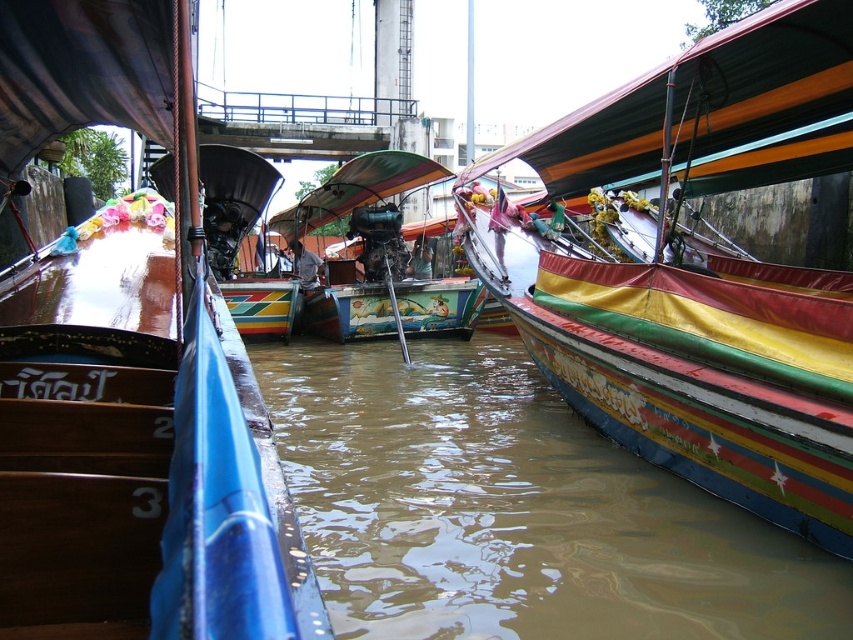
You are a tourist standing on the wooden boat at left. You want to see the brown murky water at center. Which direction should you look?

You should look downward because the brown murky water at center is located below the wooden boat at left.

You are standing on the wooden boat at left and want to move to the multicolored painted boat at center. Which direction should you go to reach it?

The multicolored painted boat at center is located below the wooden boat at left, so you should go downward to reach it.

You are a tourist standing on the wooden boat at left and want to jump into the water. Based on the scene, will you be able to jump into the brown murky water at center without any obstacles?

The brown murky water at center has a greater height compared to wooden boat at left, so yes, you can jump into the brown murky water at center from the wooden boat at left since the water is higher.